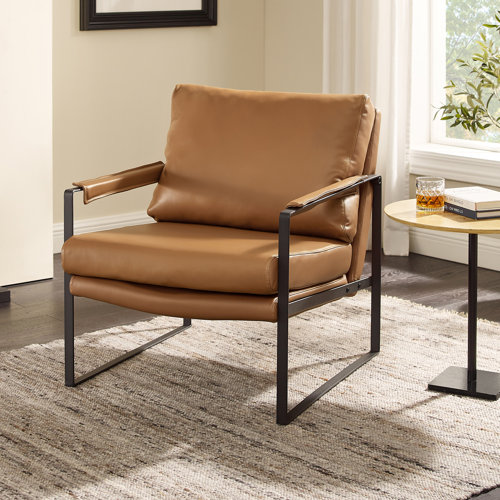
Identify the location of white curtain. Image resolution: width=500 pixels, height=500 pixels. (373, 37).